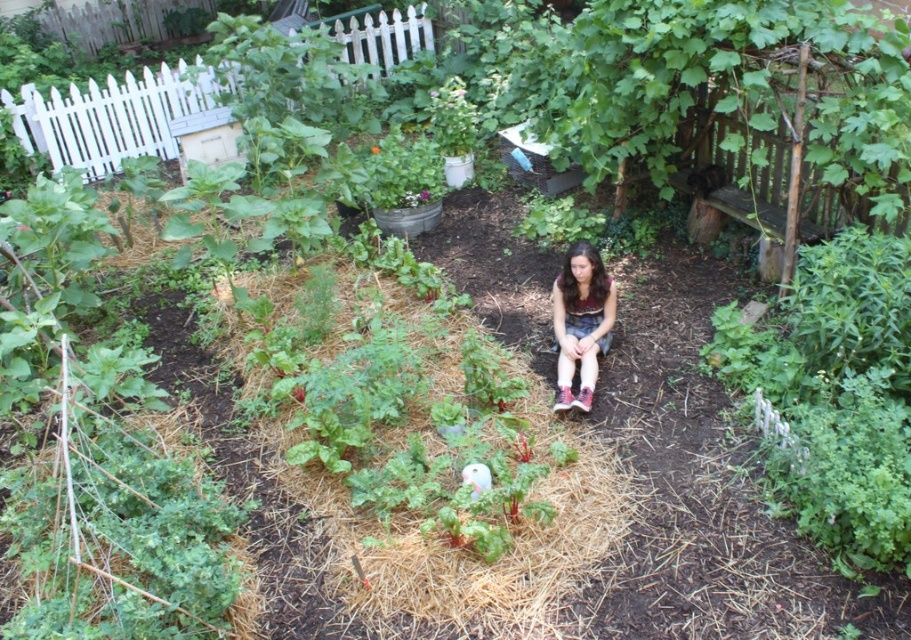
Who is more forward, (458, 509) or (571, 266)?

Point (458, 509)

What do you see at coordinates (425, 449) in the screenshot?
I see `brown straw at center` at bounding box center [425, 449].

Identify the location of brown straw at center. The image size is (911, 640). (425, 449).

Does matte brown shorts at center appear under wooden planter at center?

Indeed, matte brown shorts at center is positioned under wooden planter at center.

Which is more to the left, matte brown shorts at center or wooden planter at center?

From the viewer's perspective, wooden planter at center appears more on the left side.

Between point (594, 333) and point (382, 212), which one is positioned behind?

Positioned behind is point (382, 212).

Locate an element on the screen. matte brown shorts at center is located at coordinates (581, 323).

The height and width of the screenshot is (640, 911). I want to click on brown straw at center, so click(x=425, y=449).

Does brown straw at center appear over wooden planter at center?

Actually, brown straw at center is below wooden planter at center.

Does point (248, 408) lie behind point (410, 227)?

No, it is not.

Where is `brown straw at center`? This screenshot has height=640, width=911. brown straw at center is located at coordinates (425, 449).